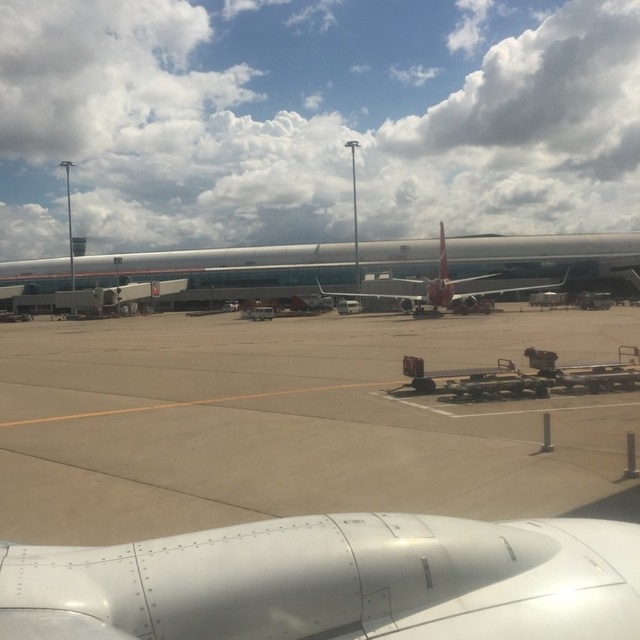
Which of these two, white fluffy cloud at upper center or metallic silver airplane at center, stands shorter?

metallic silver airplane at center is shorter.

Consider the image. Is white fluffy cloud at upper center thinner than metallic silver airplane at center?

No, white fluffy cloud at upper center is not thinner than metallic silver airplane at center.

The width and height of the screenshot is (640, 640). What do you see at coordinates (314, 120) in the screenshot? I see `white fluffy cloud at upper center` at bounding box center [314, 120].

The width and height of the screenshot is (640, 640). What are the coordinates of `white fluffy cloud at upper center` in the screenshot? It's located at (314, 120).

Does white metallic airplane wing at lower center have a lesser height compared to glossy metallic wing at center?

Correct, white metallic airplane wing at lower center is not as tall as glossy metallic wing at center.

Does point (122, 552) come farther from viewer compared to point (493, 292)?

No, it is in front of (493, 292).

Is point (332, 592) in front of point (451, 284)?

Yes.

Find the location of a particular element. The image size is (640, 640). white metallic airplane wing at lower center is located at coordinates (333, 580).

Does metallic silver airplane at center appear on the left side of silver metallic airplane at center?

Correct, you'll find metallic silver airplane at center to the left of silver metallic airplane at center.

Can you confirm if metallic silver airplane at center is shorter than silver metallic airplane at center?

Indeed, metallic silver airplane at center has a lesser height compared to silver metallic airplane at center.

Identify the location of metallic silver airplane at center. Image resolution: width=640 pixels, height=640 pixels. (227, 269).